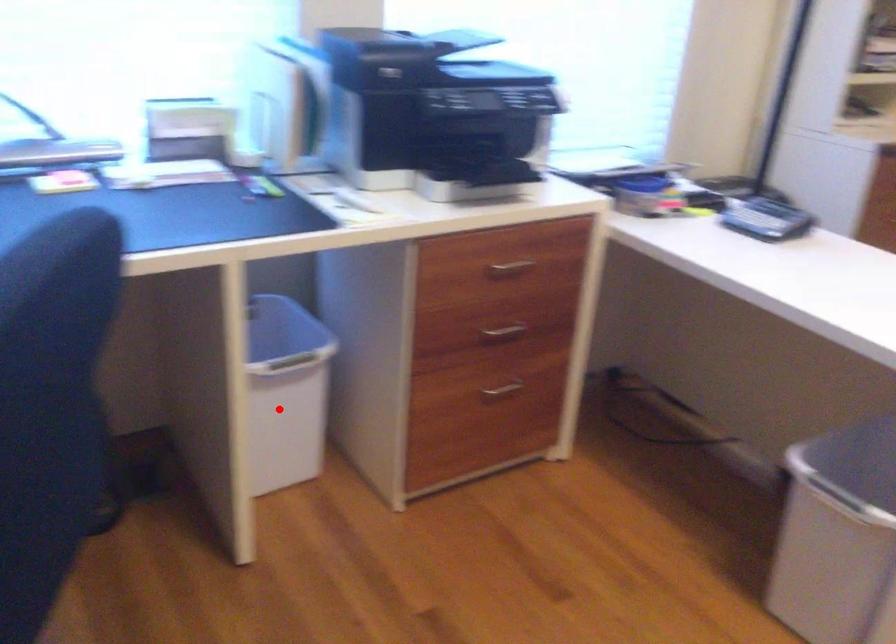
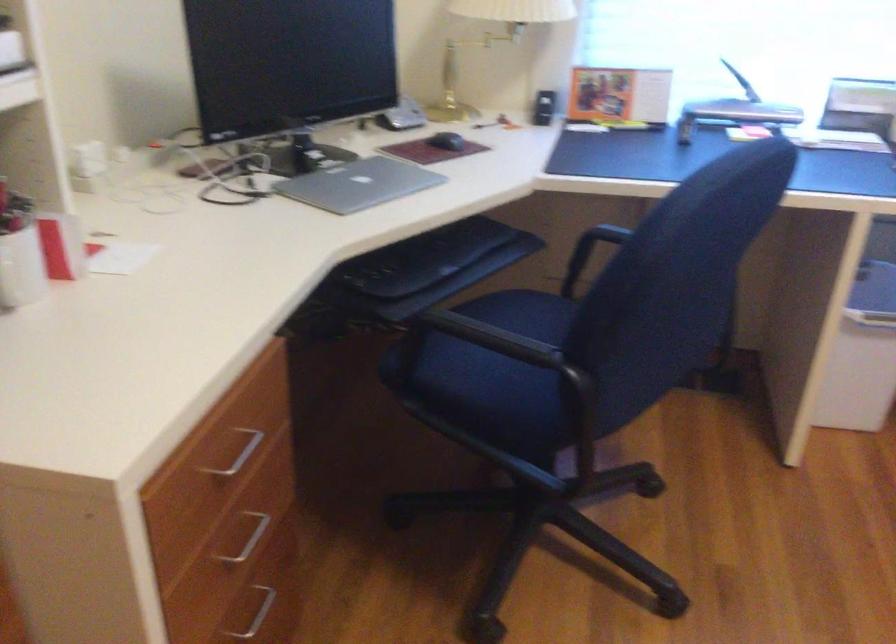
Question: I am providing you with two images of the same scene from different viewpoints. A red point is shown in image1. For the corresponding object point in image2, is it positioned nearer or farther from the camera?

Choices:
 (A) Nearer
 (B) Farther

Answer: (B)